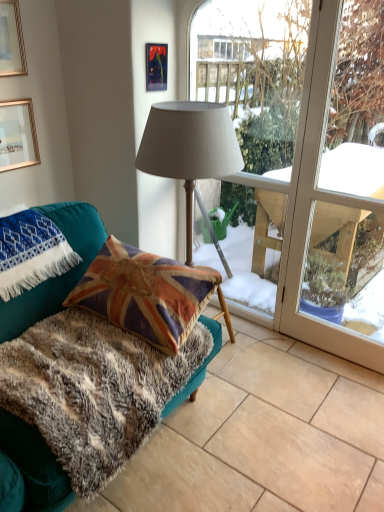
Measure the distance between point (1,111) and camera.

They are 2.18 meters apart.

This screenshot has width=384, height=512. Identify the location of matte plastic picture frame at upper center, arranged as the 1th picture frame when viewed from the right. (156, 66).

You are a GUI agent. You are given a task and a screenshot of the screen. Output one action in this format:
    pyautogui.click(x=<x>, y=<y>)
    Task: Click on the gold-framed picture at upper left, which is the 2th picture frame in right-to-left order
    The height and width of the screenshot is (512, 384).
    Given the screenshot: What is the action you would take?
    pos(11,40)

Image resolution: width=384 pixels, height=512 pixels. Identify the location of fuzzy fabric rug at lower left. (265, 435).

Does fuzzy fabric rug at lower left have a lesser height compared to teal fabric couch at lower left?

Correct, fuzzy fabric rug at lower left is not as tall as teal fabric couch at lower left.

In the scene shown: Is fuzzy fabric rug at lower left positioned in front of teal fabric couch at lower left?

No, the depth of fuzzy fabric rug at lower left is greater than that of teal fabric couch at lower left.

Are fuzzy fabric rug at lower left and teal fabric couch at lower left far apart?

No, fuzzy fabric rug at lower left is not far from teal fabric couch at lower left.

Which picture frame is the 1st one when counting from the left side of the teal fabric couch at lower left? Please provide its 2D coordinates.

[(11, 40)]

How many degrees apart are the facing directions of gold-framed picture at upper left, arranged as the second picture frame when viewed from the left, and teal fabric couch at lower left?

The angle between the facing direction of gold-framed picture at upper left, arranged as the second picture frame when viewed from the left, and the facing direction of teal fabric couch at lower left is 0.142 degrees.

From the image's perspective, is gold-framed picture at upper left, arranged as the second picture frame when viewed from the left, located above teal fabric couch at lower left?

Yes, from the image's perspective, gold-framed picture at upper left, arranged as the second picture frame when viewed from the left, is over teal fabric couch at lower left.

Which object is positioned more to the left, gold-framed picture at upper left, arranged as the second picture frame when viewed from the left, or teal fabric couch at lower left?

From the viewer's perspective, gold-framed picture at upper left, arranged as the second picture frame when viewed from the left, appears more on the left side.

Considering the positions of objects gold-framed picture at upper left, marked as the 1th picture frame in a left-to-right arrangement, and gold-framed picture at upper left, arranged as the second picture frame when viewed from the left, in the image provided, who is more to the right, gold-framed picture at upper left, marked as the 1th picture frame in a left-to-right arrangement, or gold-framed picture at upper left, arranged as the second picture frame when viewed from the left,?

From the viewer's perspective, gold-framed picture at upper left, arranged as the second picture frame when viewed from the left, appears more on the right side.

You are a GUI agent. You are given a task and a screenshot of the screen. Output one action in this format:
    pyautogui.click(x=<x>, y=<y>)
    Task: Click on the picture frame in front of the gold-framed picture at upper left, marked as the 1th picture frame in a left-to-right arrangement
    This screenshot has height=512, width=384.
    Given the screenshot: What is the action you would take?
    pyautogui.click(x=11, y=40)

Is gold-framed picture at upper left, the third picture frame viewed from the right, oriented away from gold-framed picture at upper left, arranged as the second picture frame when viewed from the left?

gold-framed picture at upper left, the third picture frame viewed from the right, is not turned away from gold-framed picture at upper left, arranged as the second picture frame when viewed from the left.

Could transparent glass window at center be considered to be inside fuzzy fabric rug at lower left?

No, transparent glass window at center is not surrounded by fuzzy fabric rug at lower left.

Is fuzzy fabric rug at lower left beside transparent glass window at center?

No, fuzzy fabric rug at lower left is not touching transparent glass window at center.

Based on the photo, from a real-world perspective, which is physically below, fuzzy fabric rug at lower left or transparent glass window at center?

fuzzy fabric rug at lower left is physically lower.

Which object is wider, fuzzy fabric rug at lower left or transparent glass window at center?

fuzzy fabric rug at lower left.

Which of these two, teal fabric couch at lower left or matte fabric lamp at center, stands shorter?

Standing shorter between the two is matte fabric lamp at center.

Where is `studio couch on the left of matte fabric lamp at center`? studio couch on the left of matte fabric lamp at center is located at coordinates (29, 470).

Are teal fabric couch at lower left and matte fabric lamp at center located far from each other?

Yes, teal fabric couch at lower left is far from matte fabric lamp at center.

From a real-world perspective, relative to matte fabric lamp at center, is teal fabric couch at lower left vertically above or below?

In terms of real-world spatial position, teal fabric couch at lower left is below matte fabric lamp at center.

Is fuzzy fabric rug at lower left behind gold-framed picture at upper left, arranged as the second picture frame when viewed from the left?

No, fuzzy fabric rug at lower left is closer to the camera.

Is point (236, 440) behind point (21, 62)?

No, it is in front of (21, 62).

Is gold-framed picture at upper left, which is the 2th picture frame in right-to-left order, at the back of fuzzy fabric rug at lower left?

No.

Between fuzzy fabric rug at lower left and matte fabric lamp at center, which one has smaller size?

Smaller between the two is fuzzy fabric rug at lower left.

Based on the photo, is fuzzy fabric rug at lower left oriented away from matte fabric lamp at center?

That's not correct — fuzzy fabric rug at lower left is not looking away from matte fabric lamp at center.

Is fuzzy fabric rug at lower left surrounding matte fabric lamp at center?

Definitely not — matte fabric lamp at center is not inside fuzzy fabric rug at lower left.

Where is `lamp behind the fuzzy fabric rug at lower left`? Image resolution: width=384 pixels, height=512 pixels. lamp behind the fuzzy fabric rug at lower left is located at coordinates (190, 152).

You are a GUI agent. You are given a task and a screenshot of the screen. Output one action in this format:
    pyautogui.click(x=<x>, y=<y>)
    Task: Click on the tile below the teal fabric couch at lower left (from the image's perspective)
    The image size is (384, 512).
    Given the screenshot: What is the action you would take?
    pyautogui.click(x=265, y=435)

Locate an element on the screen. The image size is (384, 512). the 1st picture frame to the left when counting from the teal fabric couch at lower left is located at coordinates (11, 40).

Estimate the real-world distances between objects in this image. Which object is further from gold-framed picture at upper left, marked as the 1th picture frame in a left-to-right arrangement, transparent glass window at center or matte plastic picture frame at upper center, which is counted as the 3th picture frame, starting from the left?

transparent glass window at center is further to gold-framed picture at upper left, marked as the 1th picture frame in a left-to-right arrangement.

Based on their spatial positions, is matte fabric lamp at center or gold-framed picture at upper left, marked as the 1th picture frame in a left-to-right arrangement, further from matte plastic picture frame at upper center, which is counted as the 3th picture frame, starting from the left?

Based on the image, gold-framed picture at upper left, marked as the 1th picture frame in a left-to-right arrangement, appears to be further to matte plastic picture frame at upper center, which is counted as the 3th picture frame, starting from the left.

Based on their spatial positions, is matte plastic picture frame at upper center, which is counted as the 3th picture frame, starting from the left, or teal fabric couch at lower left further from gold-framed picture at upper left, which is the 2th picture frame in right-to-left order?

teal fabric couch at lower left is positioned further to the anchor gold-framed picture at upper left, which is the 2th picture frame in right-to-left order.

When comparing their distances from gold-framed picture at upper left, marked as the 1th picture frame in a left-to-right arrangement, does matte fabric lamp at center or matte plastic picture frame at upper center, arranged as the 1th picture frame when viewed from the right, seem closer?

Based on the image, matte plastic picture frame at upper center, arranged as the 1th picture frame when viewed from the right, appears to be nearer to gold-framed picture at upper left, marked as the 1th picture frame in a left-to-right arrangement.

Considering their positions, is fuzzy fabric rug at lower left positioned further to transparent glass window at center than matte fabric lamp at center?

Among the two, matte fabric lamp at center is located further to transparent glass window at center.

Based on their spatial positions, is fuzzy fabric rug at lower left or transparent glass window at center closer to gold-framed picture at upper left, arranged as the second picture frame when viewed from the left?

transparent glass window at center is closer to gold-framed picture at upper left, arranged as the second picture frame when viewed from the left.

Considering their positions, is matte plastic picture frame at upper center, arranged as the 1th picture frame when viewed from the right, positioned further to teal fabric couch at lower left than gold-framed picture at upper left, which is the 2th picture frame in right-to-left order?

matte plastic picture frame at upper center, arranged as the 1th picture frame when viewed from the right, lies further to teal fabric couch at lower left than the other object.

Considering their positions, is teal fabric couch at lower left positioned closer to gold-framed picture at upper left, the third picture frame viewed from the right, than fuzzy fabric rug at lower left?

teal fabric couch at lower left is closer to gold-framed picture at upper left, the third picture frame viewed from the right.

The width and height of the screenshot is (384, 512). What are the coordinates of `picture frame located between gold-framed picture at upper left, arranged as the second picture frame when viewed from the left, and transparent glass window at center in the left-right direction` in the screenshot? It's located at click(156, 66).

Where is `lamp between gold-framed picture at upper left, the third picture frame viewed from the right, and fuzzy fabric rug at lower left vertically`? This screenshot has height=512, width=384. lamp between gold-framed picture at upper left, the third picture frame viewed from the right, and fuzzy fabric rug at lower left vertically is located at coordinates (190, 152).

What are the coordinates of `lamp located between blue embroidered blanket at lower left and transparent glass window at center in the left-right direction` in the screenshot? It's located at (190, 152).

Locate an element on the screen. studio couch situated between blue embroidered blanket at lower left and fuzzy fabric rug at lower left from left to right is located at coordinates (29, 470).